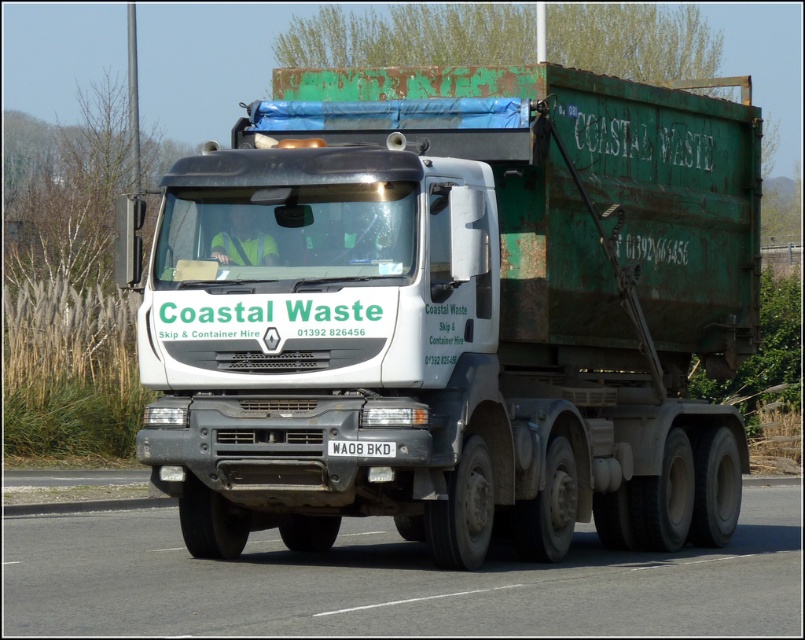
Which of these two, white matte truck at center or gray asphalt road at center, stands taller?

gray asphalt road at center is taller.

Where is `white matte truck at center`? white matte truck at center is located at coordinates (456, 310).

Can you confirm if white matte truck at center is shorter than white rectangular at center?

Incorrect, white matte truck at center's height does not fall short of white rectangular at center's.

Where is `white matte truck at center`? white matte truck at center is located at coordinates (456, 310).

Image resolution: width=805 pixels, height=640 pixels. Identify the location of white matte truck at center. (456, 310).

Does gray asphalt road at center have a lesser height compared to white rectangular at center?

No, gray asphalt road at center is not shorter than white rectangular at center.

Does gray asphalt road at center appear under white rectangular at center?

Yes, gray asphalt road at center is below white rectangular at center.

Between point (655, 598) and point (368, 445), which one is positioned in front?

Point (655, 598) is more forward.

Locate an element on the screen. gray asphalt road at center is located at coordinates (393, 582).